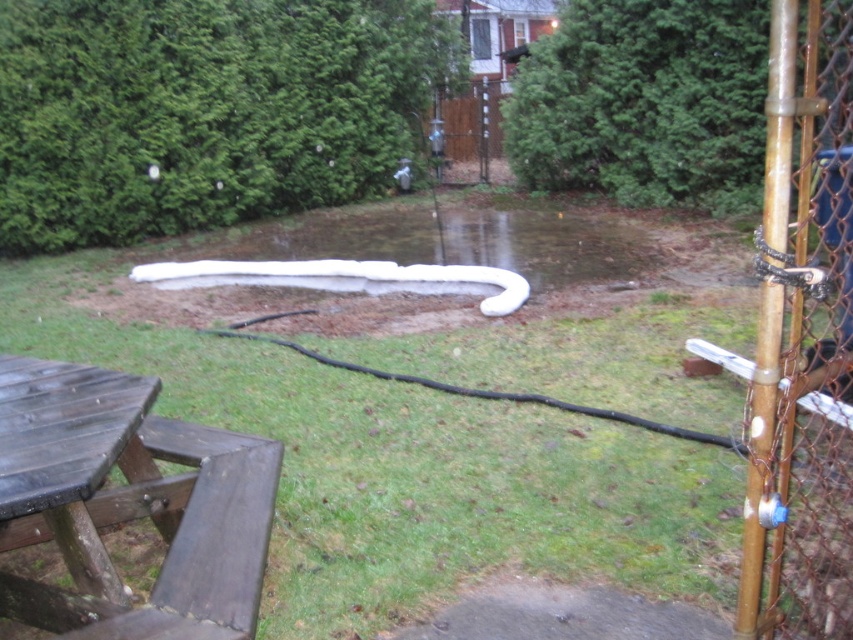
Question: Is dark brown wood picnic table at lower left to the left of rusty chain-link fence at right from the viewer's perspective?

Choices:
 (A) no
 (B) yes

Answer: (B)

Question: Observing the image, what is the correct spatial positioning of dark brown wood picnic table at lower left in reference to rusty chain-link fence at right?

Choices:
 (A) left
 (B) right

Answer: (A)

Question: Which of the following is the farthest from the observer?

Choices:
 (A) (88, 564)
 (B) (775, 362)

Answer: (A)

Question: Is dark brown wood picnic table at lower left closer to camera compared to rusty chain-link fence at right?

Choices:
 (A) no
 (B) yes

Answer: (A)

Question: Which of the following is the closest to the observer?

Choices:
 (A) rusty chain-link fence at right
 (B) dark brown wood picnic table at lower left

Answer: (A)

Question: Which point is closer to the camera?

Choices:
 (A) rusty chain-link fence at right
 (B) dark brown wood picnic table at lower left

Answer: (A)